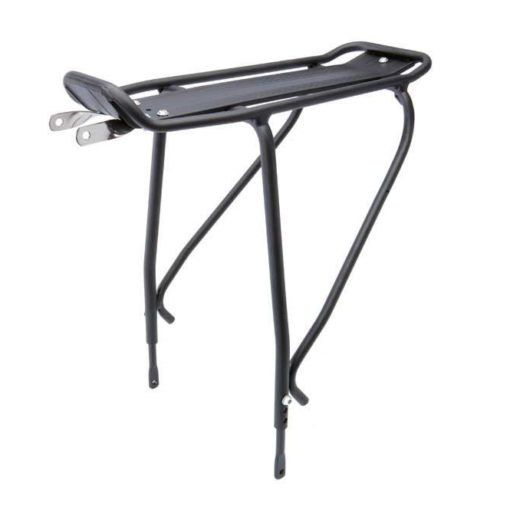
Locate an element on the screen. back of the seat is located at coordinates (391, 49).